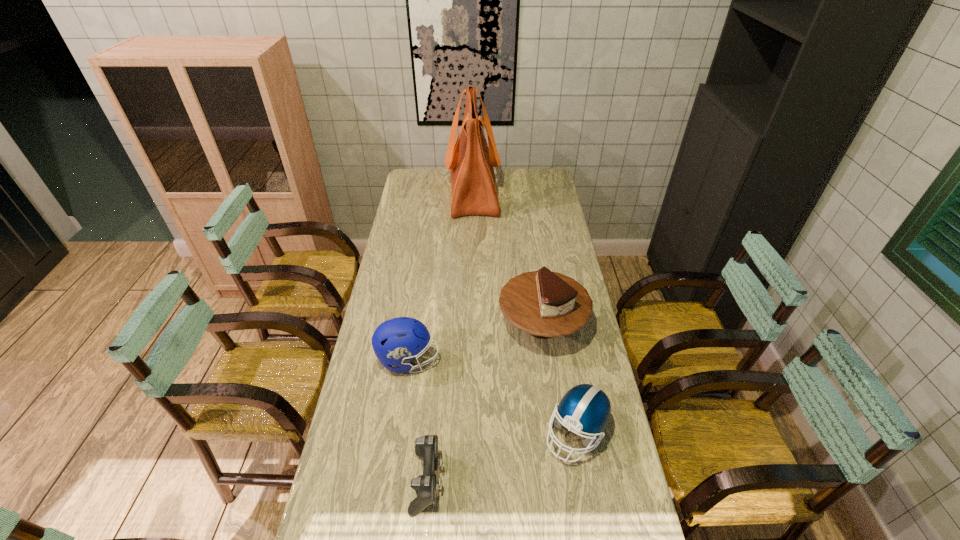
I want to click on shopping bag, so click(x=471, y=160).

This screenshot has width=960, height=540. I want to click on the tallest object, so click(471, 160).

This screenshot has height=540, width=960. What are the coordinates of `cake` in the screenshot? It's located at (545, 304).

At what (x,y) coordinates should I click in order to perform the action: click on the left football helmet. Please return your answer as a coordinate pair (x, y). Looking at the image, I should click on (397, 341).

Find the location of a particular element. the right football helmet is located at coordinates (585, 408).

Find the location of `the shorter football helmet`. the shorter football helmet is located at coordinates (585, 408).

Identify the location of control. (426, 446).

I want to click on free space located 0.050m on the front of the tallest object, so click(472, 226).

You are a GUI agent. You are given a task and a screenshot of the screen. Output one action in this format:
    pyautogui.click(x=<x>, y=<y>)
    Task: Click on the vacant area situated 0.100m on the left of the cake
    The width and height of the screenshot is (960, 540).
    Given the screenshot: What is the action you would take?
    pyautogui.click(x=470, y=325)

Image resolution: width=960 pixels, height=540 pixels. Find the location of `vacant space located 0.270m on the front-facing side of the left football helmet`. vacant space located 0.270m on the front-facing side of the left football helmet is located at coordinates (519, 360).